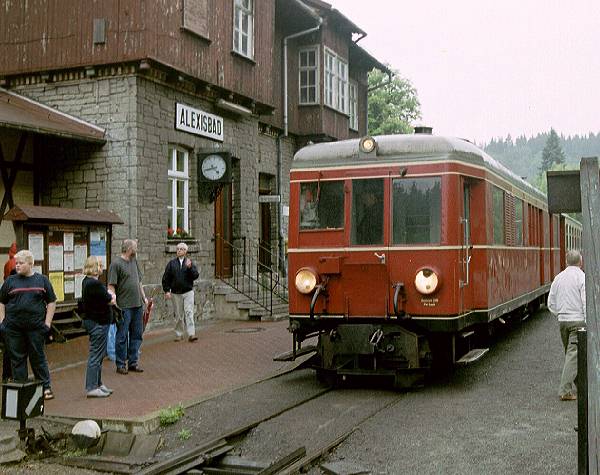
The width and height of the screenshot is (600, 475). I want to click on doors, so click(222, 223).